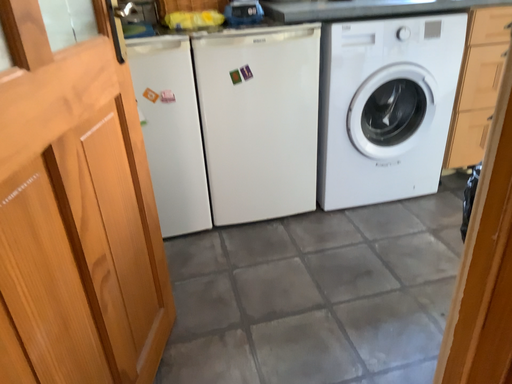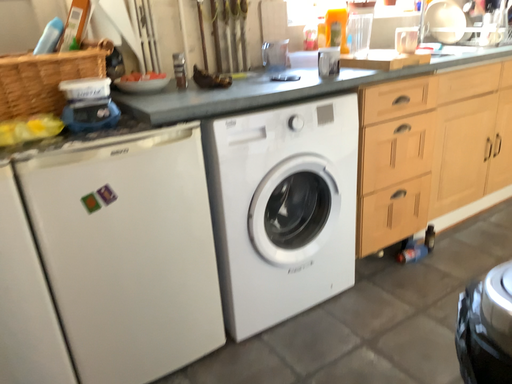
Question: How did the camera likely rotate when shooting the video?

Choices:
 (A) rotated downward
 (B) rotated upward

Answer: (B)